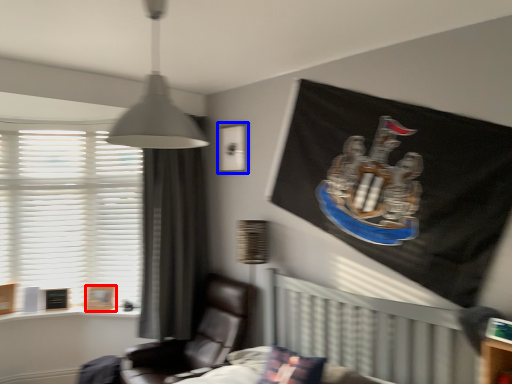
Question: Among these objects, which one is farthest to the camera, picture frame (highlighted by a red box) or picture frame (highlighted by a blue box)?

Choices:
 (A) picture frame
 (B) picture frame

Answer: (A)